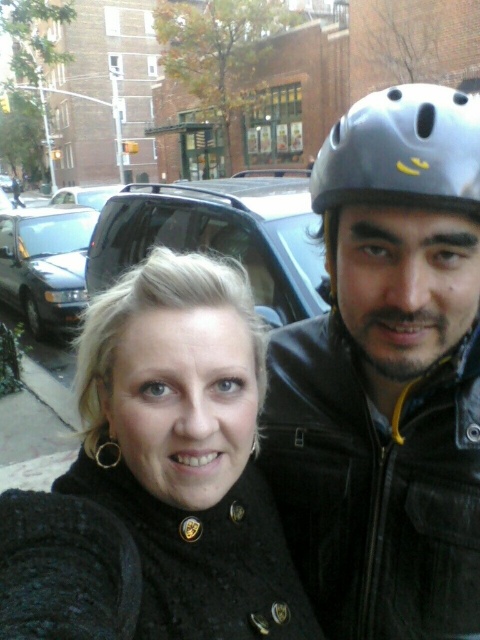
You are a photographer trying to capture a closeup shot of the matte black helmet at upper right and the gray matte helmet at upper right. Since you want to focus on both helmets equally, which helmet should you adjust your camera angle to prioritize due to its size difference?

The matte black helmet at upper right is wider than the gray matte helmet at upper right, so you should prioritize adjusting your camera angle to focus on the matte black helmet at upper right first because of its larger size.